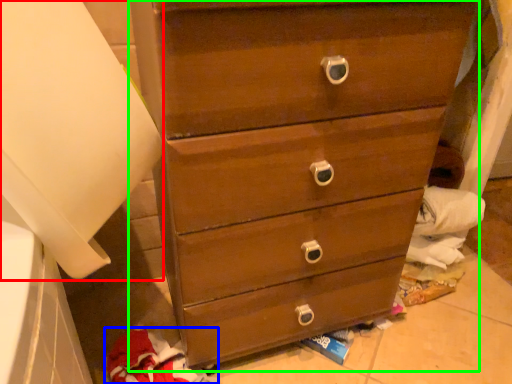
Question: Estimate the real-world distances between objects in this image. Which object is closer to paper towel (highlighted by a red box), clothing (highlighted by a blue box) or chest of drawers (highlighted by a green box)?

Choices:
 (A) clothing
 (B) chest of drawers

Answer: (B)